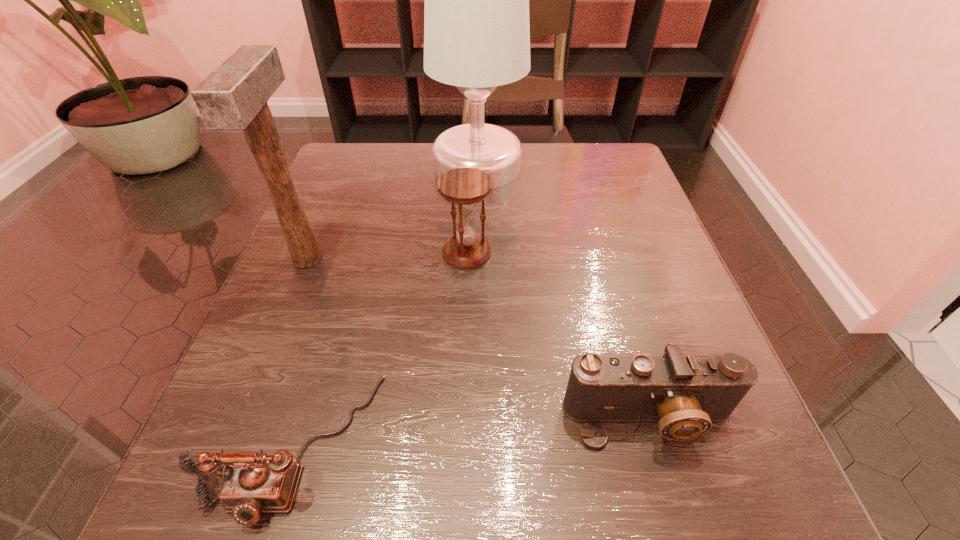
This screenshot has width=960, height=540. What are the coordinates of `blank region between the second tallest object and the shortest object` in the screenshot? It's located at (301, 352).

The image size is (960, 540). I want to click on object that ranks as the closest to the shortest object, so click(x=234, y=96).

Select which object is the third closest to the tallest object. Please provide its 2D coordinates. Your answer should be formatted as a tuple, i.e. [(x, y)], where the tuple contains the x and y coordinates of a point satisfying the conditions above.

[(254, 483)]

The image size is (960, 540). I want to click on vacant space that satisfies the following two spatial constraints: 1. on the base of the lampshade; 2. on the front side of the second tallest object, so click(x=477, y=260).